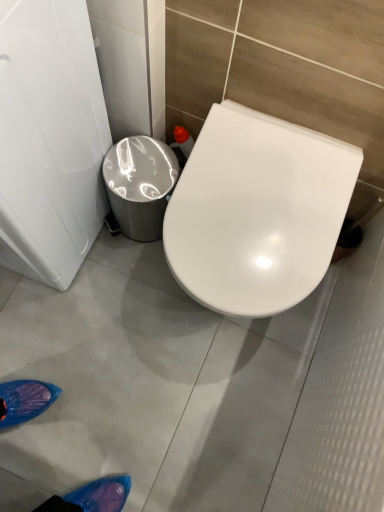
Image resolution: width=384 pixels, height=512 pixels. I want to click on shiny metallic trash can at center left, so click(x=140, y=184).

In order to face shiny metallic trash can at center left, should I rotate leftwards or rightwards?

A 6.600 degree turn to the left will do.

Describe the element at coordinates (140, 184) in the screenshot. Image resolution: width=384 pixels, height=512 pixels. I see `shiny metallic trash can at center left` at that location.

In order to face white glossy toilet seat at center, should I rotate leftwards or rightwards?

Rotate right and turn 6.381 degrees.

Describe the element at coordinates (257, 211) in the screenshot. I see `white glossy toilet seat at center` at that location.

Locate an element on the screen. white glossy toilet seat at center is located at coordinates (257, 211).

I want to click on shiny metallic trash can at center left, so click(140, 184).

Is shiny metallic trash can at center left to the right of white glossy toilet seat at center from the viewer's perspective?

Incorrect, shiny metallic trash can at center left is not on the right side of white glossy toilet seat at center.

Which object is further away from the camera, shiny metallic trash can at center left or white glossy toilet seat at center?

Positioned behind is shiny metallic trash can at center left.

Is point (124, 176) behind point (345, 198)?

Yes, point (124, 176) is behind point (345, 198).

From the image's perspective, relative to white glossy toilet seat at center, is shiny metallic trash can at center left above or below?

shiny metallic trash can at center left is above white glossy toilet seat at center.

From a real-world perspective, relative to white glossy toilet seat at center, is shiny metallic trash can at center left vertically above or below?

Clearly, from a real-world perspective, shiny metallic trash can at center left is below white glossy toilet seat at center.

Which object is thinner, shiny metallic trash can at center left or white glossy toilet seat at center?

With smaller width is shiny metallic trash can at center left.

From the picture: Between shiny metallic trash can at center left and white glossy toilet seat at center, which one has more height?

white glossy toilet seat at center is taller.

Considering the relative sizes of shiny metallic trash can at center left and white glossy toilet seat at center in the image provided, is shiny metallic trash can at center left bigger than white glossy toilet seat at center?

No, shiny metallic trash can at center left is not bigger than white glossy toilet seat at center.

Does shiny metallic trash can at center left contain white glossy toilet seat at center?

No, white glossy toilet seat at center is located outside of shiny metallic trash can at center left.

Is shiny metallic trash can at center left far away from white glossy toilet seat at center?

They are positioned close to each other.

Is white glossy toilet seat at center at the back of shiny metallic trash can at center left?

No, shiny metallic trash can at center left is not facing the opposite direction of white glossy toilet seat at center.

This screenshot has height=512, width=384. In order to click on trash bin/can below the white glossy toilet seat at center (from a real-world perspective) in this screenshot , I will do `click(140, 184)`.

Considering the relative positions of white glossy toilet seat at center and shiny metallic trash can at center left in the image provided, is white glossy toilet seat at center to the left or to the right of shiny metallic trash can at center left?

white glossy toilet seat at center is to the right of shiny metallic trash can at center left.

Is white glossy toilet seat at center further to camera compared to shiny metallic trash can at center left?

No.

Does point (208, 253) appear closer or farther from the camera than point (152, 166)?

Point (208, 253).

From the image's perspective, is white glossy toilet seat at center above shiny metallic trash can at center left?

No, from the image's perspective, white glossy toilet seat at center is not over shiny metallic trash can at center left.

Consider the image. From a real-world perspective, which object stands above the other?

From a 3D spatial view, white glossy toilet seat at center is above.

Considering the relative sizes of white glossy toilet seat at center and shiny metallic trash can at center left in the image provided, is white glossy toilet seat at center thinner than shiny metallic trash can at center left?

No, white glossy toilet seat at center is not thinner than shiny metallic trash can at center left.

Is white glossy toilet seat at center shorter than shiny metallic trash can at center left?

In fact, white glossy toilet seat at center may be taller than shiny metallic trash can at center left.

Which of these two, white glossy toilet seat at center or shiny metallic trash can at center left, is bigger?

With larger size is white glossy toilet seat at center.

Is shiny metallic trash can at center left surrounded by white glossy toilet seat at center?

No.

Can you see white glossy toilet seat at center touching shiny metallic trash can at center left?

There is a gap between white glossy toilet seat at center and shiny metallic trash can at center left.

Could you tell me if white glossy toilet seat at center is turned towards shiny metallic trash can at center left?

No, white glossy toilet seat at center is not facing towards shiny metallic trash can at center left.

How many degrees apart are the facing directions of white glossy toilet seat at center and shiny metallic trash can at center left?

The facing directions of white glossy toilet seat at center and shiny metallic trash can at center left are 5.74e-05 degrees apart.

Find the location of `toilet lying on the right of shiny metallic trash can at center left`. toilet lying on the right of shiny metallic trash can at center left is located at coordinates (257, 211).

Where is `toilet located above the shiny metallic trash can at center left (from a real-world perspective)`? This screenshot has width=384, height=512. toilet located above the shiny metallic trash can at center left (from a real-world perspective) is located at coordinates (257, 211).

In the image, there is a white glossy toilet seat at center. Identify the location of trash bin/can above it (from the image's perspective). Image resolution: width=384 pixels, height=512 pixels. (140, 184).